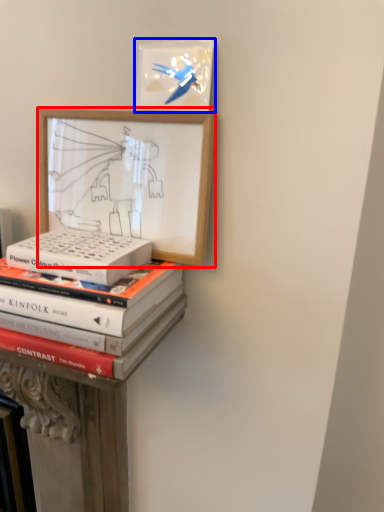
Question: Which object appears farthest to the camera in this image, picture frame (highlighted by a red box) or picture frame (highlighted by a blue box)?

Choices:
 (A) picture frame
 (B) picture frame

Answer: (B)